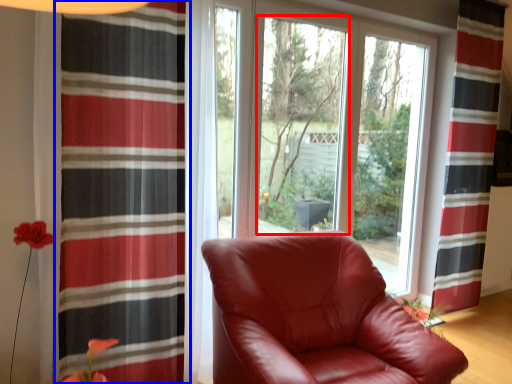
Question: Which of the following is the closest to the observer, window screen (highlighted by a red box) or curtain (highlighted by a blue box)?

Choices:
 (A) window screen
 (B) curtain

Answer: (B)